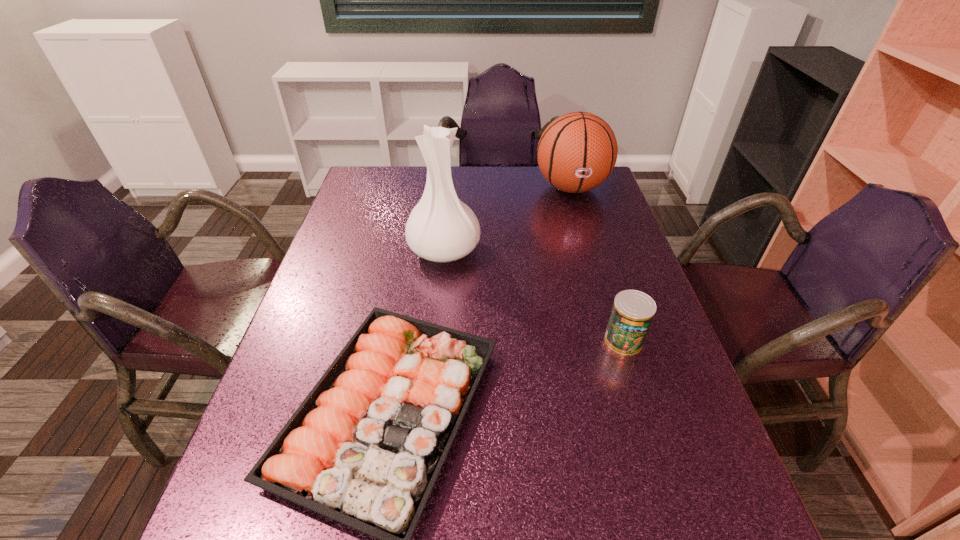
This screenshot has width=960, height=540. Identify the location of the closest object to the vase. (365, 448).

The height and width of the screenshot is (540, 960). Find the location of `the closest object relative to the third nearest object`. the closest object relative to the third nearest object is located at coordinates (365, 448).

Identify the location of free space that satisfies the following two spatial constraints: 1. on the side where the inflation valve is located; 2. on the left side of the third shortest object. Image resolution: width=960 pixels, height=540 pixels. (616, 340).

Image resolution: width=960 pixels, height=540 pixels. In order to click on free region that satisfies the following two spatial constraints: 1. on the side where the inflation valve is located; 2. on the left side of the second shortest object in this screenshot , I will do `click(616, 340)`.

Where is `vacant space that satisfies the following two spatial constraints: 1. on the side where the inflation valve is located; 2. on the right side of the can`? vacant space that satisfies the following two spatial constraints: 1. on the side where the inflation valve is located; 2. on the right side of the can is located at coordinates (616, 340).